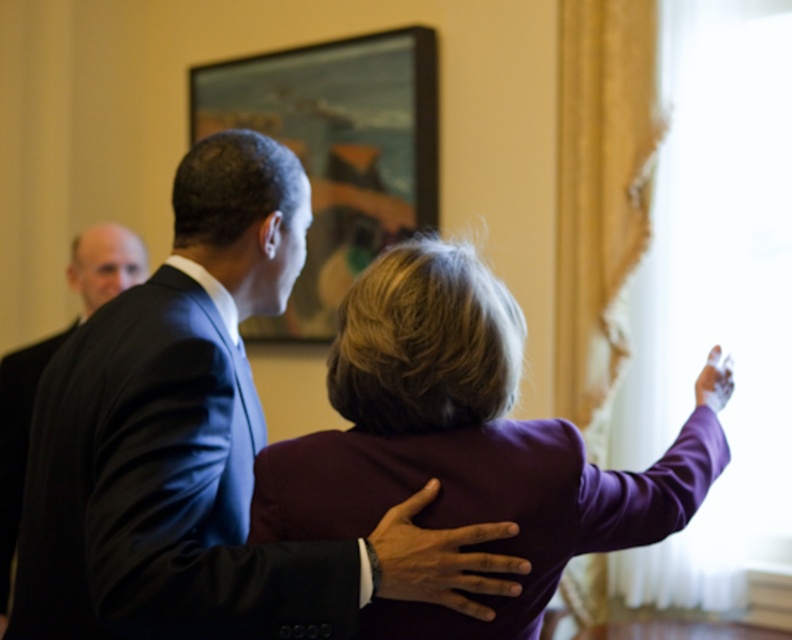
Question: Which object is the closest to the purple fabric coat at upper center?

Choices:
 (A) dark blue smooth suit at center
 (B) wooden frame at upper center
 (C) black matte suit at left
 (D) black suit at left

Answer: (A)

Question: Can you confirm if purple fabric coat at upper center is bigger than black suit at left?

Choices:
 (A) yes
 (B) no

Answer: (B)

Question: Which of the following is the farthest from the observer?

Choices:
 (A) black matte suit at left
 (B) black suit at left
 (C) dark blue smooth suit at center

Answer: (B)

Question: Is purple fabric coat at upper center closer to camera compared to black suit at left?

Choices:
 (A) no
 (B) yes

Answer: (B)

Question: Which object appears farthest from the camera in this image?

Choices:
 (A) black matte suit at left
 (B) black suit at left
 (C) purple fabric coat at upper center

Answer: (B)

Question: Does wooden frame at upper center appear over black matte suit at left?

Choices:
 (A) yes
 (B) no

Answer: (A)